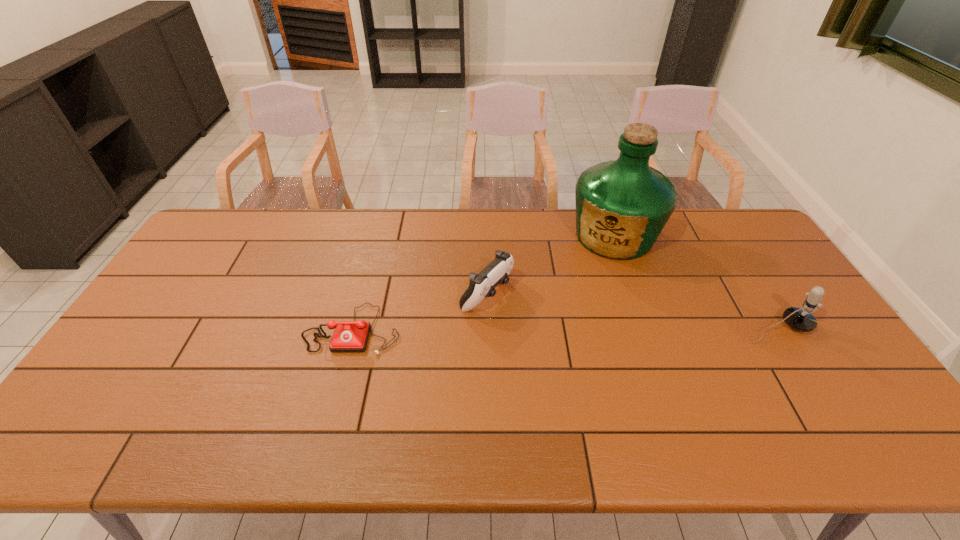
Where is `vacant position located on the front-facing side of the third tallest object`? Image resolution: width=960 pixels, height=540 pixels. vacant position located on the front-facing side of the third tallest object is located at coordinates (547, 329).

Locate an element on the screen. Image resolution: width=960 pixels, height=540 pixels. free spot located on the front-facing side of the third tallest object is located at coordinates (x=576, y=345).

The height and width of the screenshot is (540, 960). I want to click on vacant area situated on the label side of the liquor, so click(566, 308).

Identify the location of vacant space situated on the label side of the liquor. The width and height of the screenshot is (960, 540). (577, 292).

Where is `free space located on the label side of the liquor`? The image size is (960, 540). free space located on the label side of the liquor is located at coordinates (573, 298).

Where is `object that is at the far edge`? object that is at the far edge is located at coordinates (622, 206).

Image resolution: width=960 pixels, height=540 pixels. What are the coordinates of `object located in the right edge section of the desktop` in the screenshot? It's located at pos(799,319).

Where is `free space at the far edge of the desktop`? free space at the far edge of the desktop is located at coordinates (334, 222).

Locate an element on the screen. vacant region at the near edge of the desktop is located at coordinates (243, 406).

The image size is (960, 540). Identify the location of blank space at the left edge of the desktop. (224, 252).